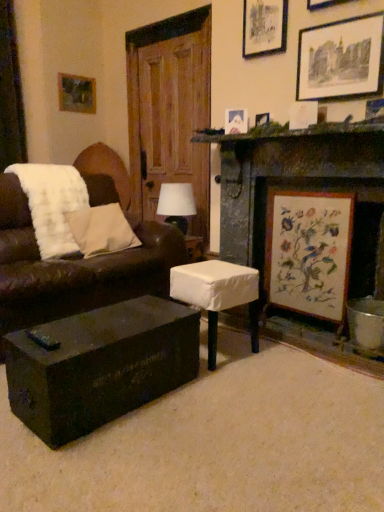
In order to click on free location in front of wooden fireplace at right in this screenshot , I will do `click(276, 400)`.